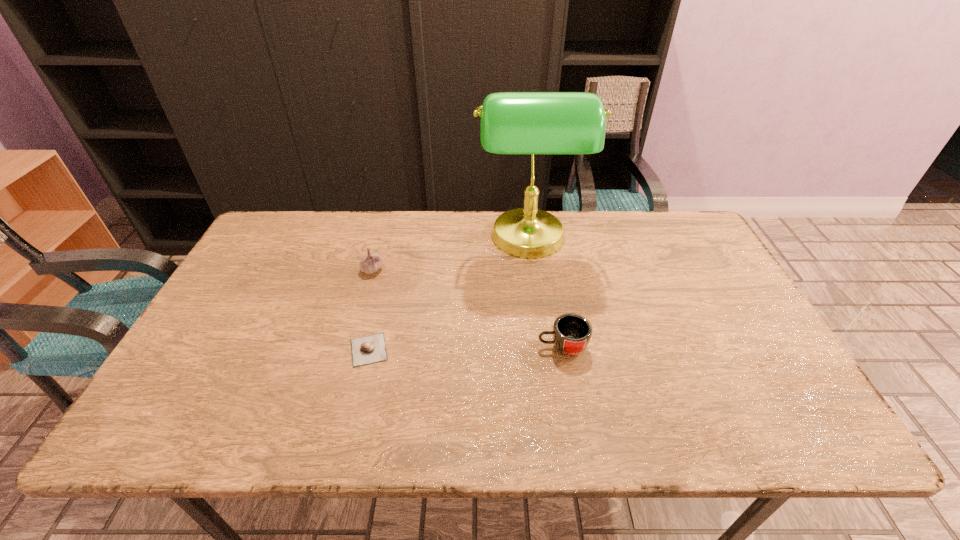
Where is `the tallest object`? the tallest object is located at coordinates (532, 123).

Locate an element on the screen. Image resolution: width=960 pixels, height=540 pixels. the taller garlic is located at coordinates (371, 263).

Where is `mug`? mug is located at coordinates (572, 332).

Find the location of a particular element. The height and width of the screenshot is (540, 960). the shorter garlic is located at coordinates (369, 349).

Find the location of a particular element. Image resolution: width=960 pixels, height=540 pixels. the shortest object is located at coordinates click(369, 349).

The image size is (960, 540). Identify the location of vacant area situated 0.340m on the desk next to the lamp. (369, 241).

Identify the location of vacant space located 0.200m on the desk next to the lamp. The image size is (960, 540). (413, 241).

Find the location of a particular element. blank space located on the desk next to the lamp is located at coordinates (394, 241).

At what (x,y) coordinates should I click in order to perform the action: click on free location located on the right of the taller garlic. Please return your answer as a coordinate pair (x, y). The image size is (960, 540). Looking at the image, I should click on (454, 270).

Locate an element on the screen. This screenshot has height=540, width=960. free point located 0.230m on the side of the mug with the handle is located at coordinates (445, 347).